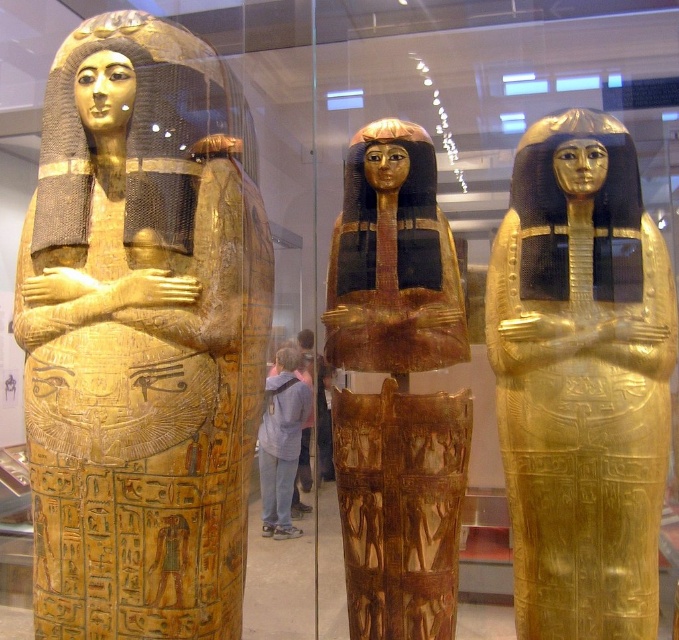
You are a museum visitor standing in front of the glass barrier. You want to take a photo of the gold polished sarcophagus at left and the gold polished wood sarcophagus at center. Which one will appear larger in your photo?

The gold polished sarcophagus at left will appear larger in your photo because it is positioned in front of the gold polished wood sarcophagus at center, making it closer to the camera.

You are a visitor standing in front of the gold polished sarcophagus at left. The museum has a rule that visitors must stay at least 6 feet away from all exhibits. Are you violating the rule?

The gold polished sarcophagus at left and viewer are 5.79 feet apart from each other. Since 5.79 feet is less than 6 feet, you are violating the museum rule by being too close to the gold polished sarcophagus at left.

You are a museum visitor standing in front of the glass barrier. You want to take a photo of both the gold polished sarcophagus at left and the gold polished sarcophagus at center. Which sarcophagus should you focus on first if you want to include both in the frame without moving the camera?

You should focus on the gold polished sarcophagus at center first because it is smaller and closer to the center, allowing both sarcophagi to fit within the frame.